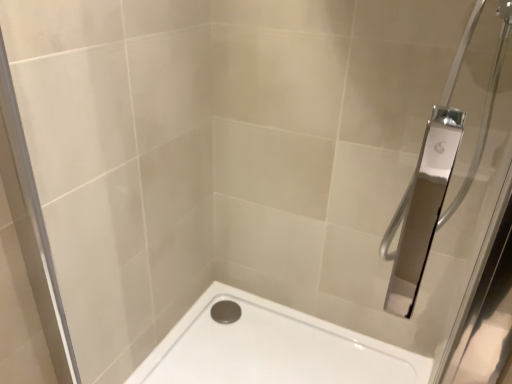
Image resolution: width=512 pixels, height=384 pixels. I want to click on white glossy bathtub at lower center, so click(271, 348).

What do you see at coordinates (271, 348) in the screenshot? The image size is (512, 384). I see `white glossy bathtub at lower center` at bounding box center [271, 348].

At what (x,y) coordinates should I click in order to perform the action: click on white glossy bathtub at lower center. Please return your answer as a coordinate pair (x, y). The height and width of the screenshot is (384, 512). Looking at the image, I should click on (271, 348).